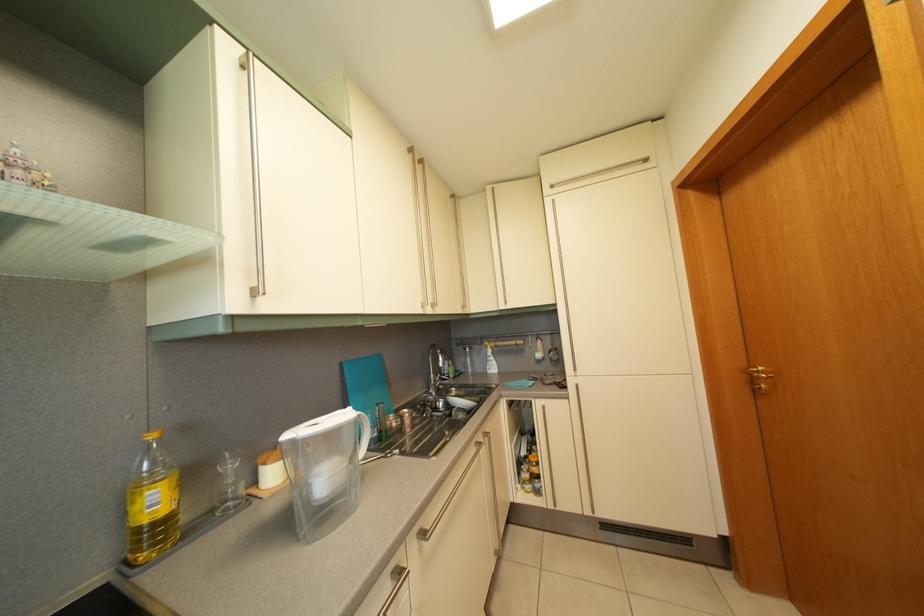
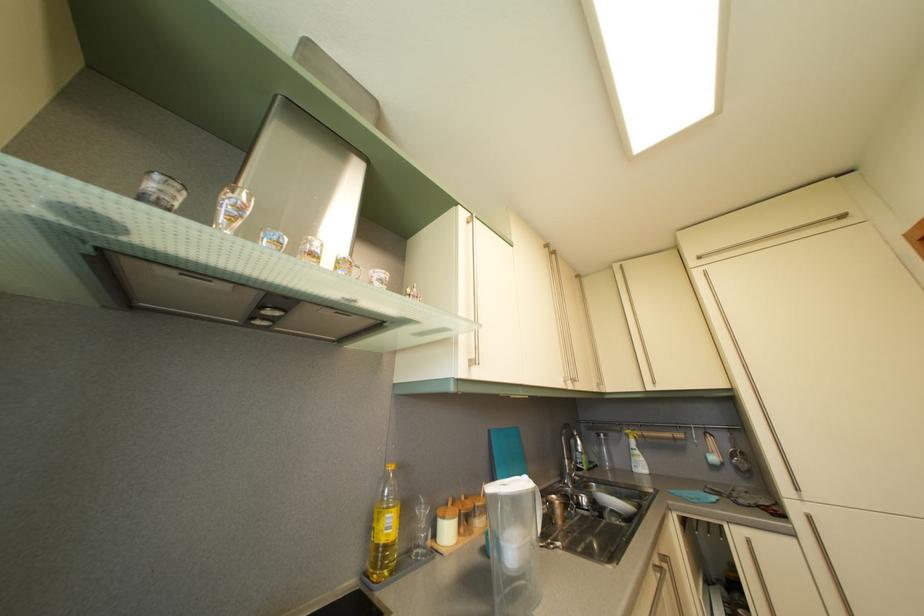
Locate, in the second image, the point that corresponds to point 270,467 in the first image.

(448, 519)